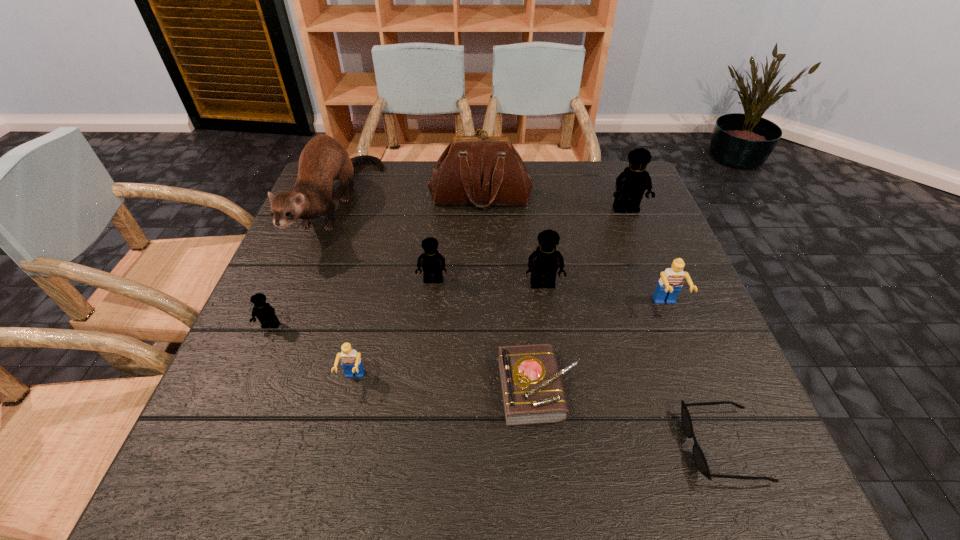
The width and height of the screenshot is (960, 540). What are the coordinates of `free space located 0.090m on the front-facing side of the second yellow Lego from right to left` in the screenshot? It's located at (548, 326).

You are a GUI agent. You are given a task and a screenshot of the screen. Output one action in this format:
    pyautogui.click(x=<x>, y=<y>)
    Task: Click on the vacant space situated 0.380m on the front-facing side of the second smallest yellow Lego
    
    Given the screenshot: What is the action you would take?
    pyautogui.click(x=415, y=452)

Where is `vacant space located on the face of the bigger blue Lego`? The image size is (960, 540). vacant space located on the face of the bigger blue Lego is located at coordinates (709, 416).

Where is `vacant area situated 0.160m on the front-facing side of the smallest yellow Lego`? vacant area situated 0.160m on the front-facing side of the smallest yellow Lego is located at coordinates (238, 402).

You are a GUI agent. You are given a task and a screenshot of the screen. Output one action in this format:
    pyautogui.click(x=<x>, y=<y>)
    Task: Click on the vacant region located on the face of the smaller blue Lego
    
    Given the screenshot: What is the action you would take?
    pyautogui.click(x=336, y=454)

At what (x,y) coordinates should I click in order to perform the action: click on free region located on the left of the diary. Please return your answer as a coordinate pair (x, y). The image size is (960, 540). Looking at the image, I should click on (456, 388).

The height and width of the screenshot is (540, 960). Identify the location of vacant space located 0.140m on the front-facing side of the shortest object. (607, 446).

Where is `free spot located on the front-facing side of the shortest object`? free spot located on the front-facing side of the shortest object is located at coordinates (489, 446).

The width and height of the screenshot is (960, 540). I want to click on free location located 0.180m on the front-facing side of the shortest object, so click(583, 446).

Where is `shoulder bag that is at the far edge`? shoulder bag that is at the far edge is located at coordinates (483, 170).